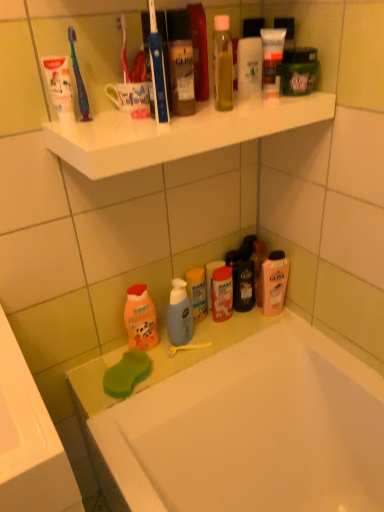
Question: Should I look upward or downward to see green matte jar at upper right, which appears as the 1th mouthwash when viewed from the top?

Choices:
 (A) down
 (B) up

Answer: (B)

Question: Can you confirm if white matte toothpaste at upper left is smaller than green sponge at lower left?

Choices:
 (A) yes
 (B) no

Answer: (A)

Question: Could you tell me if white matte toothpaste at upper left is facing green sponge at lower left?

Choices:
 (A) no
 (B) yes

Answer: (A)

Question: From a real-world perspective, is white matte toothpaste at upper left over green sponge at lower left?

Choices:
 (A) yes
 (B) no

Answer: (A)

Question: From the image's perspective, is white matte toothpaste at upper left on top of green sponge at lower left?

Choices:
 (A) no
 (B) yes

Answer: (B)

Question: Does white matte toothpaste at upper left lie in front of green sponge at lower left?

Choices:
 (A) yes
 (B) no

Answer: (A)

Question: Is white matte toothpaste at upper left to the left of green sponge at lower left from the viewer's perspective?

Choices:
 (A) no
 (B) yes

Answer: (B)

Question: Is green sponge at lower left oriented towards orange matte bottle at lower left?

Choices:
 (A) yes
 (B) no

Answer: (B)

Question: Is green sponge at lower left completely or partially outside of orange matte bottle at lower left?

Choices:
 (A) yes
 (B) no

Answer: (A)

Question: Can you confirm if green sponge at lower left is smaller than orange matte bottle at lower left?

Choices:
 (A) no
 (B) yes

Answer: (B)

Question: Is green sponge at lower left taller than orange matte bottle at lower left?

Choices:
 (A) no
 (B) yes

Answer: (A)

Question: Is green sponge at lower left far from orange matte bottle at lower left?

Choices:
 (A) no
 (B) yes

Answer: (A)

Question: From the image's perspective, does green sponge at lower left appear higher than orange matte bottle at lower left?

Choices:
 (A) no
 (B) yes

Answer: (A)

Question: Does blue plastic toothbrush at upper center, the 2th toothbrush from the left, appear on the right side of multicolored plastic toothbrush at upper left, the 1th toothbrush in the left-to-right sequence?

Choices:
 (A) yes
 (B) no

Answer: (A)